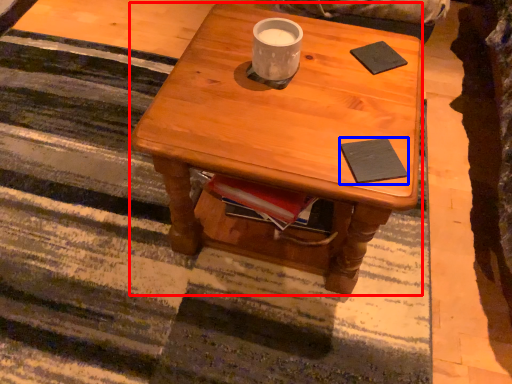
Question: Among these objects, which one is nearest to the camera, desk (highlighted by a red box) or pad (highlighted by a blue box)?

Choices:
 (A) desk
 (B) pad

Answer: (A)